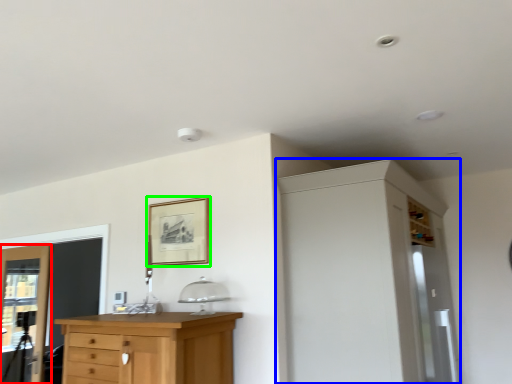
Question: Which object is the closest to the door (highlighted by a red box)? Choose among these: dresser (highlighted by a blue box) or picture frame (highlighted by a green box).

Choices:
 (A) dresser
 (B) picture frame

Answer: (B)